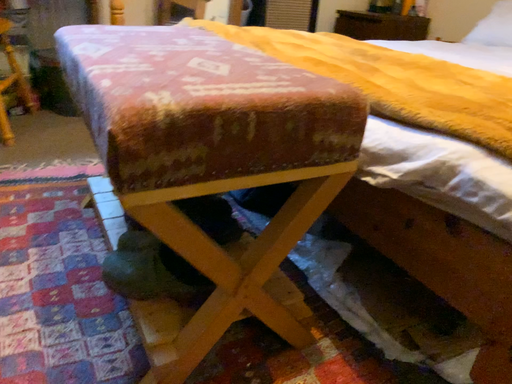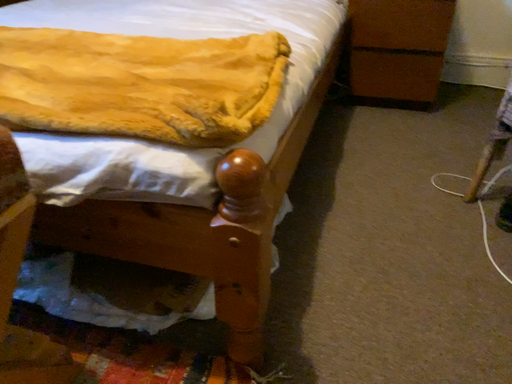
Question: Which way did the camera rotate in the video?

Choices:
 (A) rotated right
 (B) rotated left

Answer: (A)